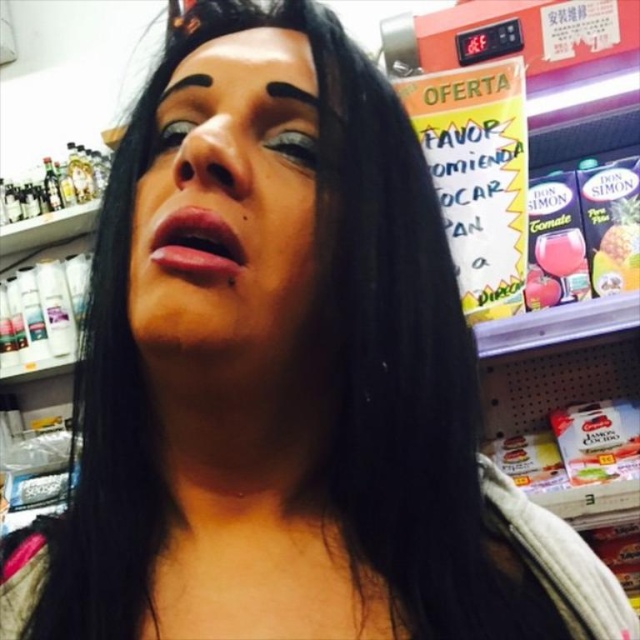
You are a photographer adjusting the focus on your camera. You need to capture both the matte black eye at upper center and the matte black eye at center in sharp detail. Given that your camera can only focus on objects within a 2.5 inch range, will both eyes be in focus?

The matte black eye at upper center and the matte black eye at center are 2.60 inches apart, which exceeds the camera focus range of 2.5 inches. Therefore, both eyes cannot be in focus simultaneously.

You are a photographer trying to capture the person in the image without blurring the background. Which eye, the matte black eye at upper center or the matte black eye at center, should you focus on to ensure the background is blurred?

You should focus on the matte black eye at upper center because it is in front of the matte black eye at center, so focusing on it would place the background further out of focus.

You are a customer in a store and you see the matte black eye at center and the black matte eyebrow at upper left on a person. Which object is located lower on their face?

The matte black eye at center is located below the black matte eyebrow at upper left, so the matte black eye at center is lower on the face.